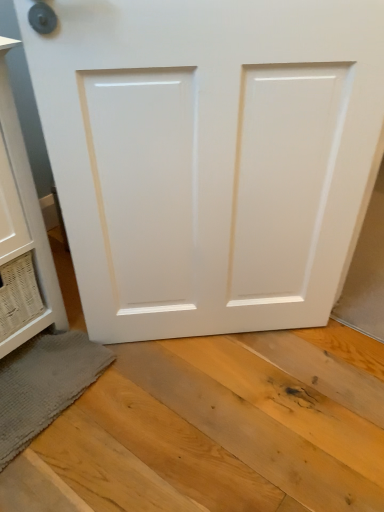
Question: Is gray textured bath mat at lower left looking in the opposite direction of white glossy cabinet at left?

Choices:
 (A) no
 (B) yes

Answer: (B)

Question: From a real-world perspective, is gray textured bath mat at lower left located higher than white glossy cabinet at left?

Choices:
 (A) yes
 (B) no

Answer: (B)

Question: From the image's perspective, would you say gray textured bath mat at lower left is positioned over white glossy cabinet at left?

Choices:
 (A) yes
 (B) no

Answer: (B)

Question: Is gray textured bath mat at lower left beside white glossy cabinet at left?

Choices:
 (A) no
 (B) yes

Answer: (A)

Question: Is the depth of gray textured bath mat at lower left greater than that of white glossy cabinet at left?

Choices:
 (A) yes
 (B) no

Answer: (A)

Question: Are gray textured bath mat at lower left and white glossy cabinet at left far apart?

Choices:
 (A) yes
 (B) no

Answer: (B)

Question: Is white glossy door at center turned away from white glossy cabinet at left?

Choices:
 (A) no
 (B) yes

Answer: (A)

Question: Is white glossy door at center taller than white glossy cabinet at left?

Choices:
 (A) no
 (B) yes

Answer: (B)

Question: Does white glossy door at center contain white glossy cabinet at left?

Choices:
 (A) yes
 (B) no

Answer: (B)

Question: Considering the relative positions of white glossy door at center and white glossy cabinet at left in the image provided, is white glossy door at center to the right of white glossy cabinet at left from the viewer's perspective?

Choices:
 (A) yes
 (B) no

Answer: (A)

Question: From the image's perspective, would you say white glossy door at center is shown under white glossy cabinet at left?

Choices:
 (A) yes
 (B) no

Answer: (A)

Question: Is white glossy door at center next to white glossy cabinet at left?

Choices:
 (A) yes
 (B) no

Answer: (B)

Question: Would you say white glossy cabinet at left is outside white glossy door at center?

Choices:
 (A) yes
 (B) no

Answer: (A)